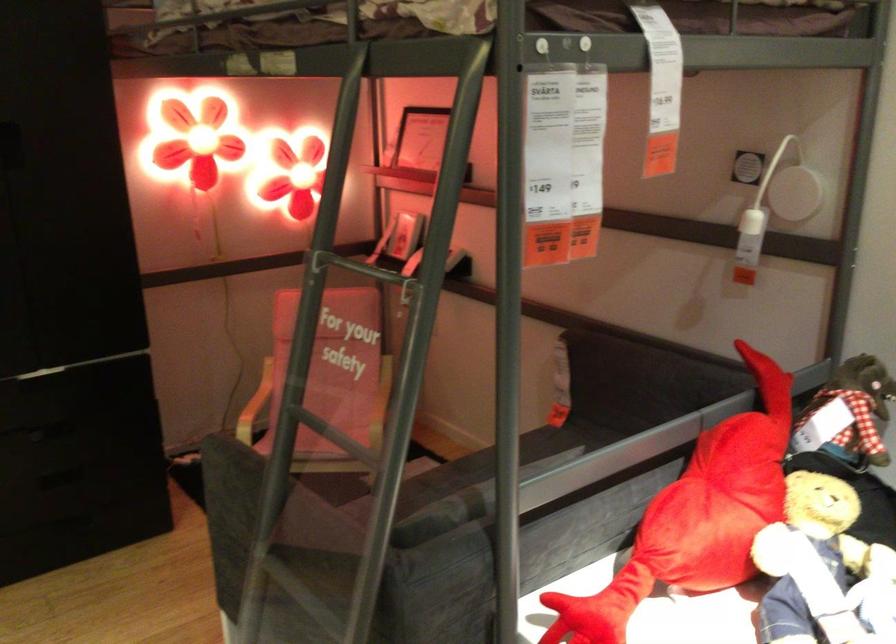
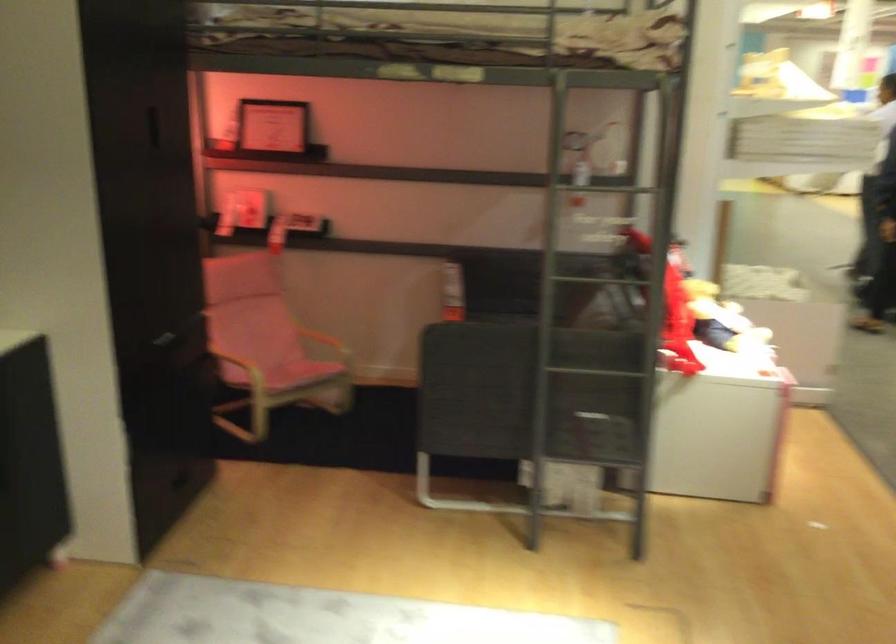
In the second image, find the point that corresponds to (x=454, y=401) in the first image.

(332, 328)